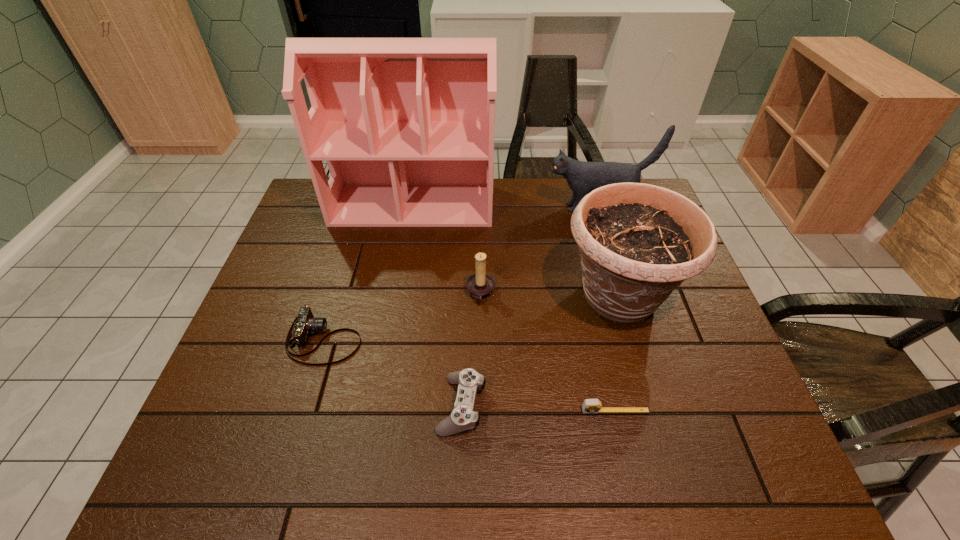
Identify the location of object that is at the near edge. (463, 417).

Where is `dollhouse situated at the left edge`? This screenshot has height=540, width=960. dollhouse situated at the left edge is located at coordinates (406, 125).

Find the location of a particular element. The image size is (960, 540). camera situated at the left edge is located at coordinates (306, 324).

Locate an element on the screen. This screenshot has width=960, height=540. cat that is at the right edge is located at coordinates (582, 177).

You are a GUI agent. You are given a task and a screenshot of the screen. Output one action in this format:
    pyautogui.click(x=<x>, y=<y>)
    Task: Click on the flowerpot that is at the right edge
    The width and height of the screenshot is (960, 540).
    Given the screenshot: What is the action you would take?
    pyautogui.click(x=638, y=242)

I want to click on object at the far left corner, so click(x=406, y=125).

Identify the location of object present at the far right corner. (582, 177).

Where is `free region at the far edge`? Image resolution: width=960 pixels, height=540 pixels. free region at the far edge is located at coordinates (526, 207).

The width and height of the screenshot is (960, 540). I want to click on vacant space at the near edge of the desktop, so click(x=436, y=447).

Find the location of `vacant space at the left edge of the desktop`. vacant space at the left edge of the desktop is located at coordinates (237, 392).